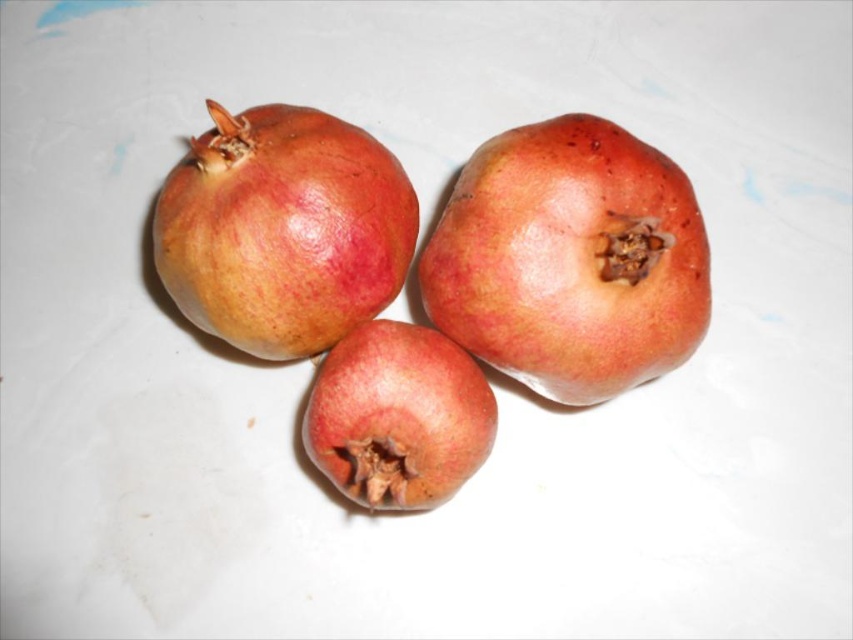
Question: Based on their relative distances, which object is nearer to the matte red pomegranate at upper left?

Choices:
 (A) shiny red pomegranate at center
 (B) matte red pomegranate at center

Answer: (B)

Question: Does matte red pomegranate at upper left have a larger size compared to matte red pomegranate at center?

Choices:
 (A) no
 (B) yes

Answer: (B)

Question: Estimate the real-world distances between objects in this image. Which object is closer to the shiny red pomegranate at center?

Choices:
 (A) matte red pomegranate at upper left
 (B) matte red pomegranate at center

Answer: (B)

Question: Which of the following is the farthest from the observer?

Choices:
 (A) (170, 172)
 (B) (669, 278)
 (C) (486, 381)

Answer: (A)

Question: Can you confirm if matte red pomegranate at upper left is positioned to the left of matte red pomegranate at center?

Choices:
 (A) no
 (B) yes

Answer: (B)

Question: Does shiny red pomegranate at center appear over matte red pomegranate at center?

Choices:
 (A) no
 (B) yes

Answer: (B)